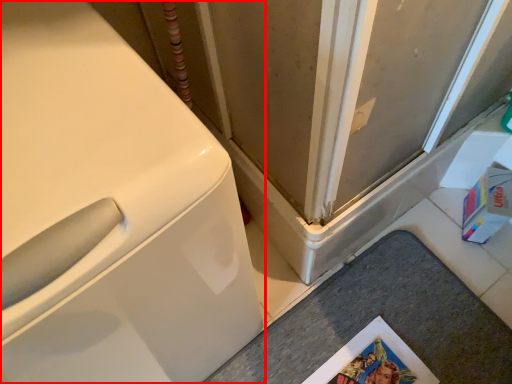
Question: From the image's perspective, where is washing machine (annotated by the red box) located in relation to counter top in the image?

Choices:
 (A) below
 (B) above

Answer: (B)